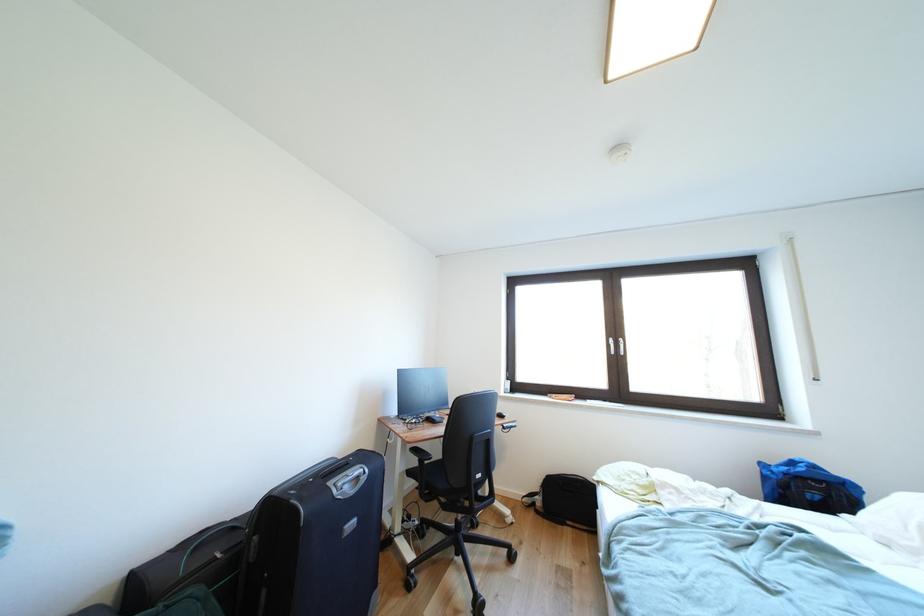
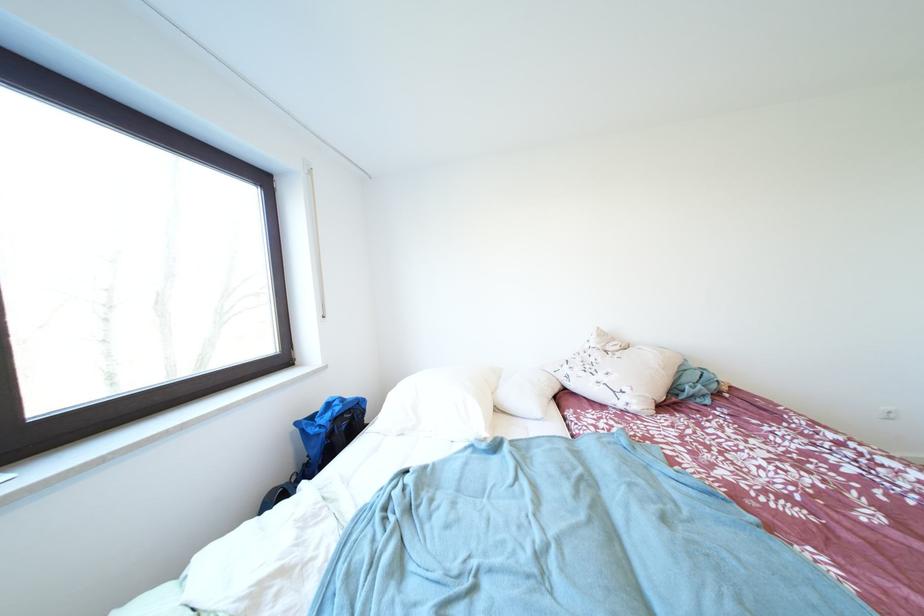
In the second image, find the point that corresponds to (769,468) in the first image.

(305, 428)